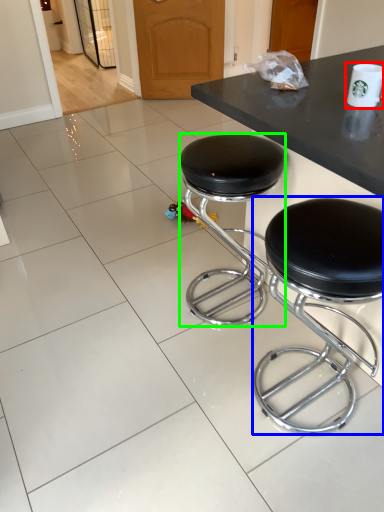
Question: Which object is the farthest from paper cup (highlighted by a red box)? Choose among these: stool (highlighted by a blue box) or stool (highlighted by a green box).

Choices:
 (A) stool
 (B) stool

Answer: (B)